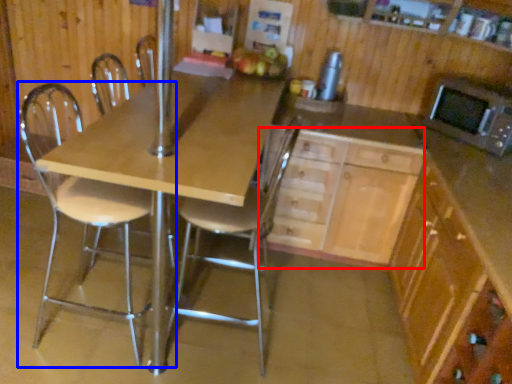
Question: Which object is further to the camera taking this photo, cabinetry (highlighted by a red box) or chair (highlighted by a blue box)?

Choices:
 (A) cabinetry
 (B) chair

Answer: (A)